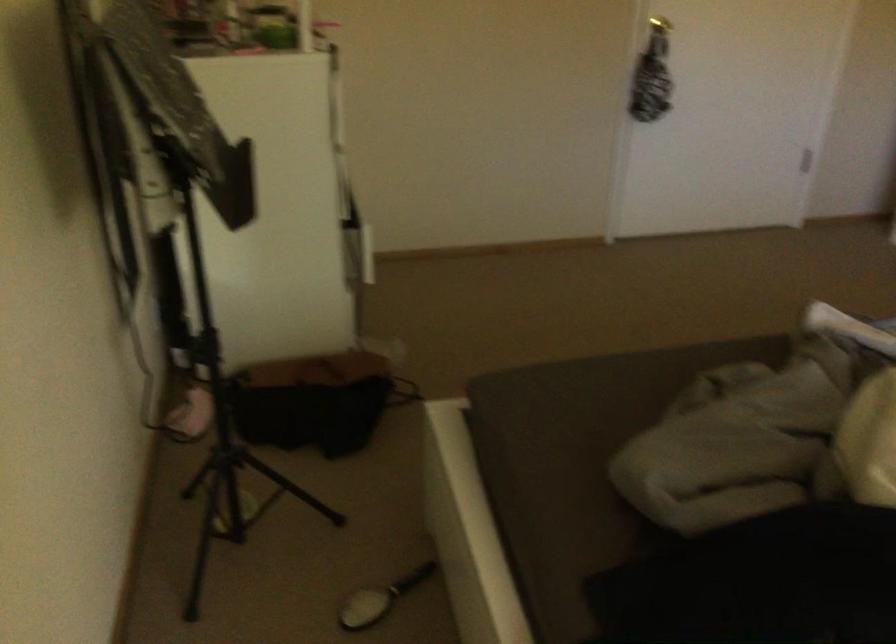
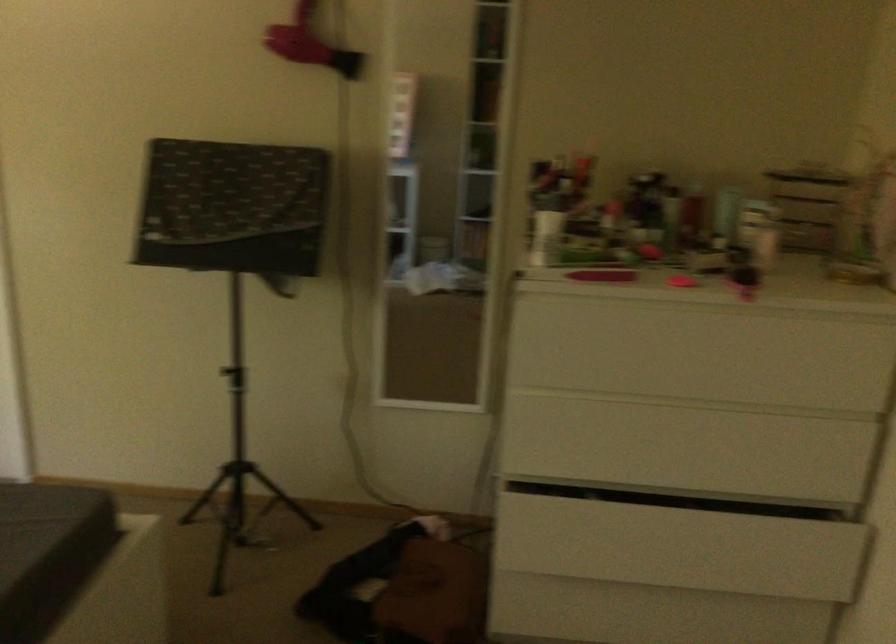
Question: I am providing you with two images of the same scene from different viewpoints. Which of the following objects are not visible in image2?

Choices:
 (A) hairbrush on floor
 (B) greenish cup
 (C) sofa sitting surface
 (D) brown bag

Answer: (A)